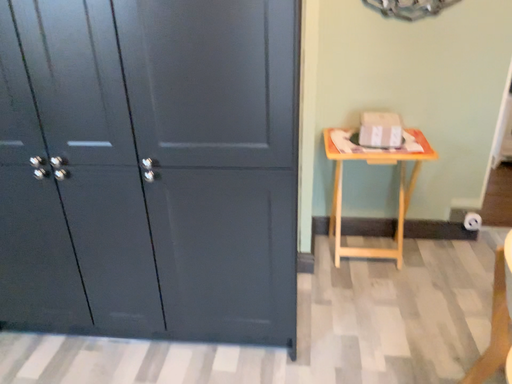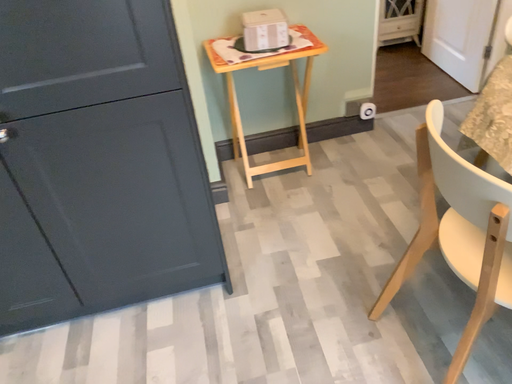
Question: How did the camera likely rotate when shooting the video?

Choices:
 (A) rotated left
 (B) rotated right

Answer: (B)